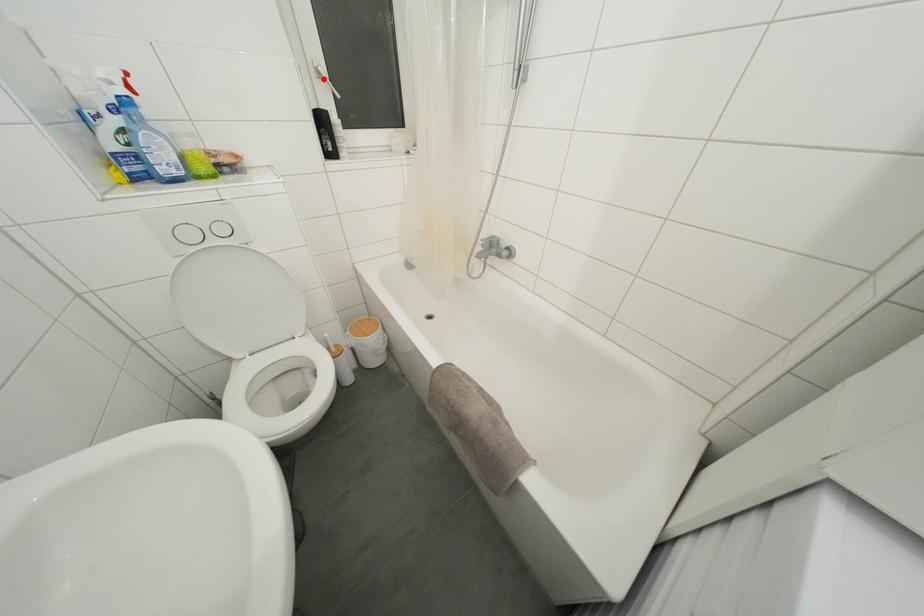
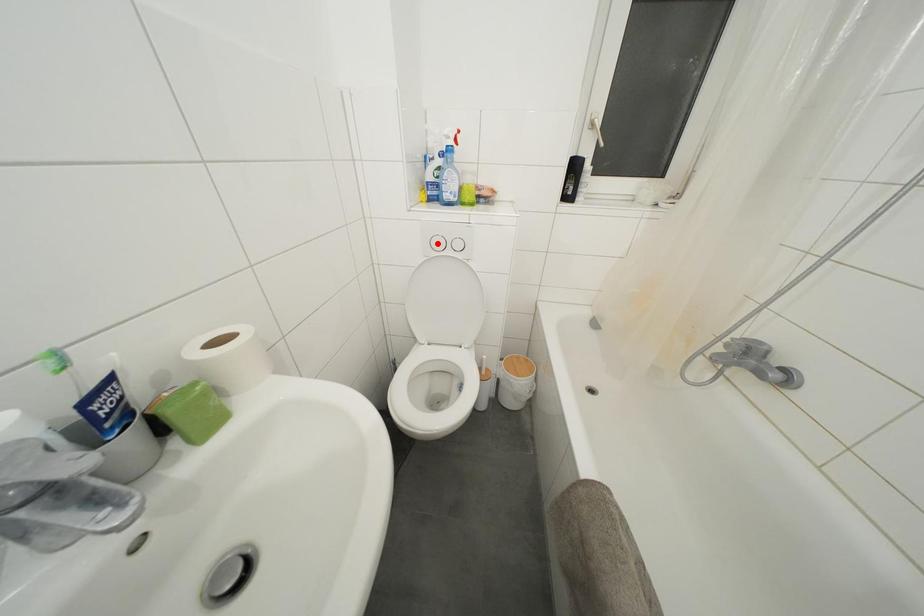
I am providing you with two images of the same scene from different viewpoints. A red point is marked on the first image and another point is marked on the second image. Do the highlighted points in image1 and image2 indicate the same real-world spot?

No